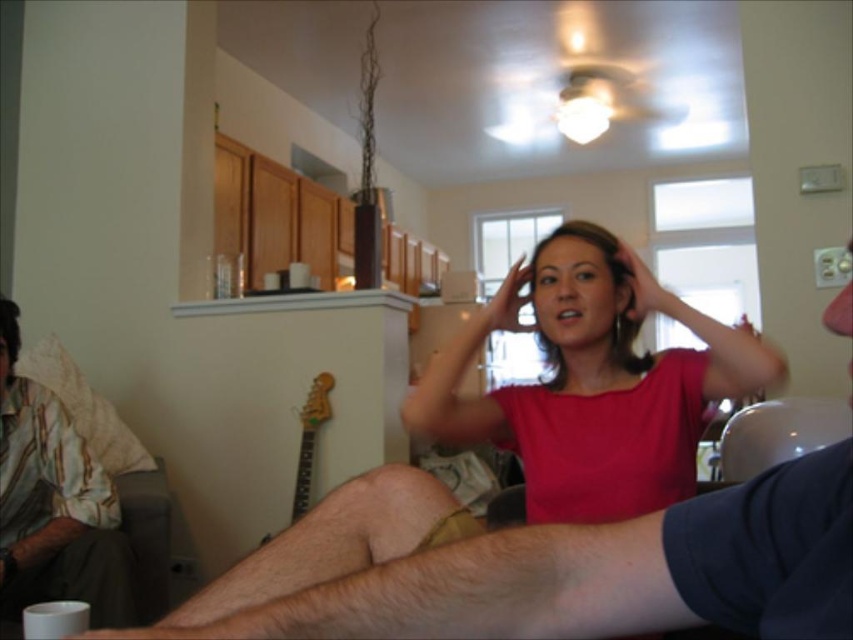
Question: Does pink matte shirt at center appear under striped cotton shirt at left?

Choices:
 (A) yes
 (B) no

Answer: (B)

Question: Which point appears closest to the camera in this image?

Choices:
 (A) (606, 429)
 (B) (97, 486)

Answer: (A)

Question: Does pink matte shirt at center come behind striped cotton shirt at left?

Choices:
 (A) no
 (B) yes

Answer: (A)

Question: Which object appears farthest from the camera in this image?

Choices:
 (A) striped cotton shirt at left
 (B) pink matte shirt at center

Answer: (A)

Question: Can you confirm if pink matte shirt at center is positioned below striped cotton shirt at left?

Choices:
 (A) no
 (B) yes

Answer: (A)